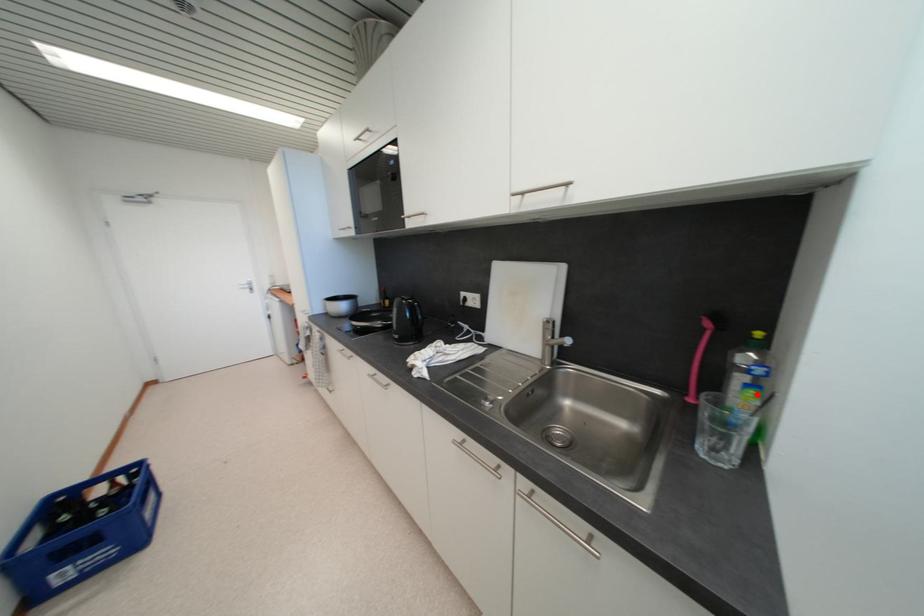
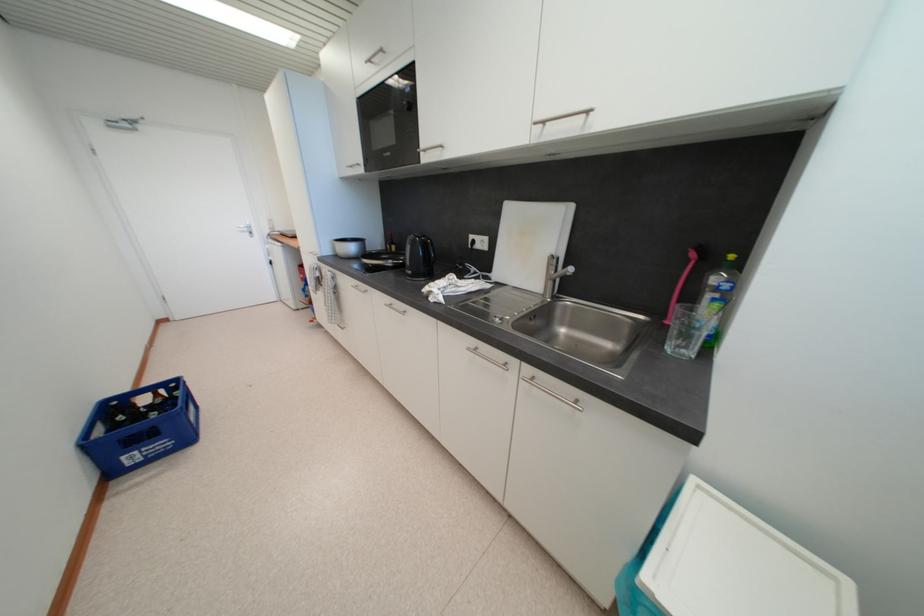
In the second image, find the point that corresponds to the highlighted location in the first image.

(723, 307)